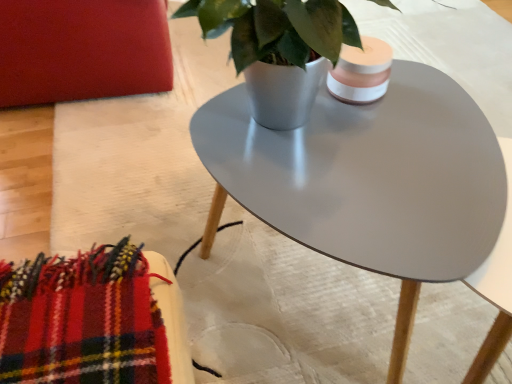
Where is `empty space that is to the right of matte gray pot at center`? empty space that is to the right of matte gray pot at center is located at coordinates (438, 134).